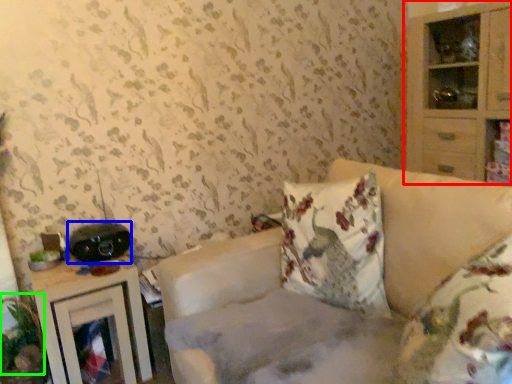
Question: Which object is positioned farthest from cabinetry (highlighted by a red box)? Select from stereo (highlighted by a blue box) and plant (highlighted by a green box).

Choices:
 (A) stereo
 (B) plant

Answer: (B)